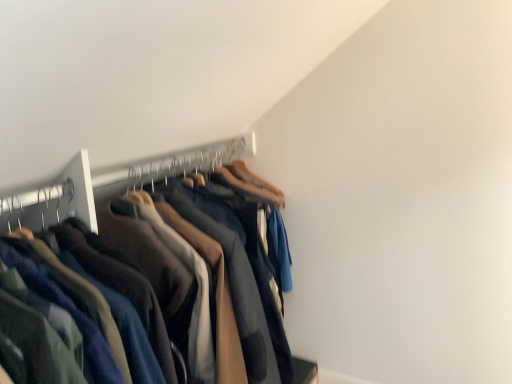
Question: Is point (147, 183) closer or farther from the camera than point (243, 360)?

Choices:
 (A) closer
 (B) farther

Answer: (B)

Question: In terms of height, does wooden hanger at upper center look taller or shorter compared to dark blue cotton pants at center?

Choices:
 (A) short
 (B) tall

Answer: (A)

Question: Relative to dark blue cotton pants at center, is wooden hanger at upper center in front or behind?

Choices:
 (A) front
 (B) behind

Answer: (B)

Question: Visually, is dark blue cotton pants at center positioned to the left or to the right of wooden hanger at upper center?

Choices:
 (A) right
 (B) left

Answer: (B)

Question: In terms of height, does dark blue cotton pants at center look taller or shorter compared to wooden hanger at upper center?

Choices:
 (A) tall
 (B) short

Answer: (A)

Question: Is dark blue cotton pants at center wider or thinner than wooden hanger at upper center?

Choices:
 (A) wide
 (B) thin

Answer: (A)

Question: From a real-world perspective, relative to wooden hanger at upper center, is dark blue cotton pants at center vertically above or below?

Choices:
 (A) below
 (B) above

Answer: (A)